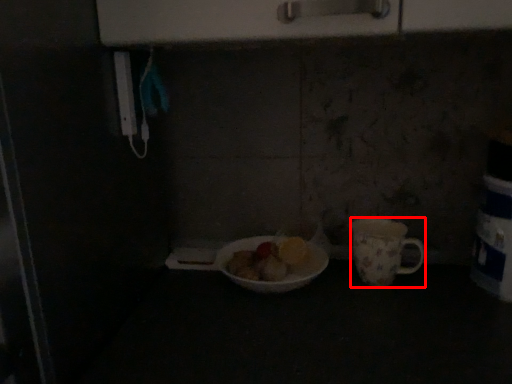
Question: From the image's perspective, what is the correct spatial positioning of coffee cup (annotated by the red box) in reference to tableware?

Choices:
 (A) below
 (B) above

Answer: (B)